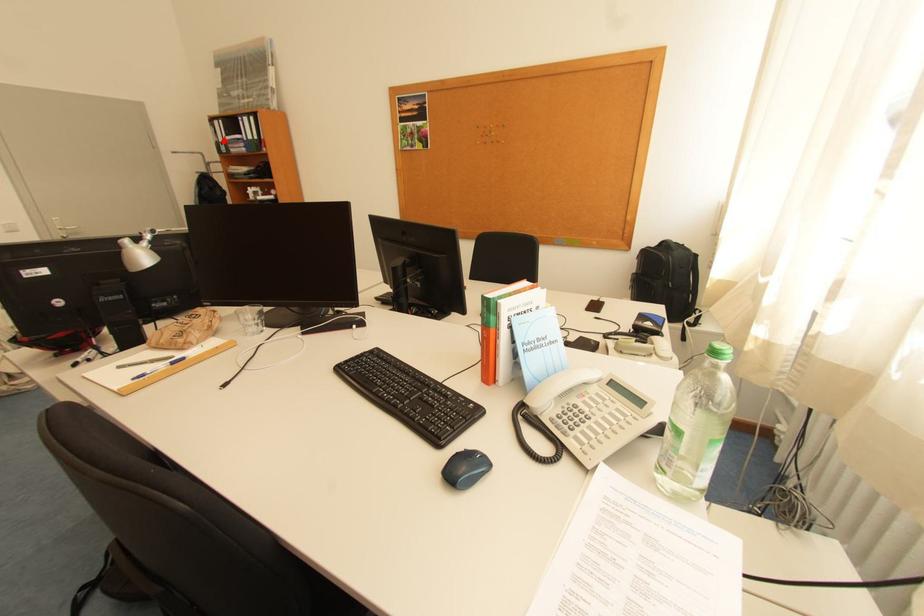
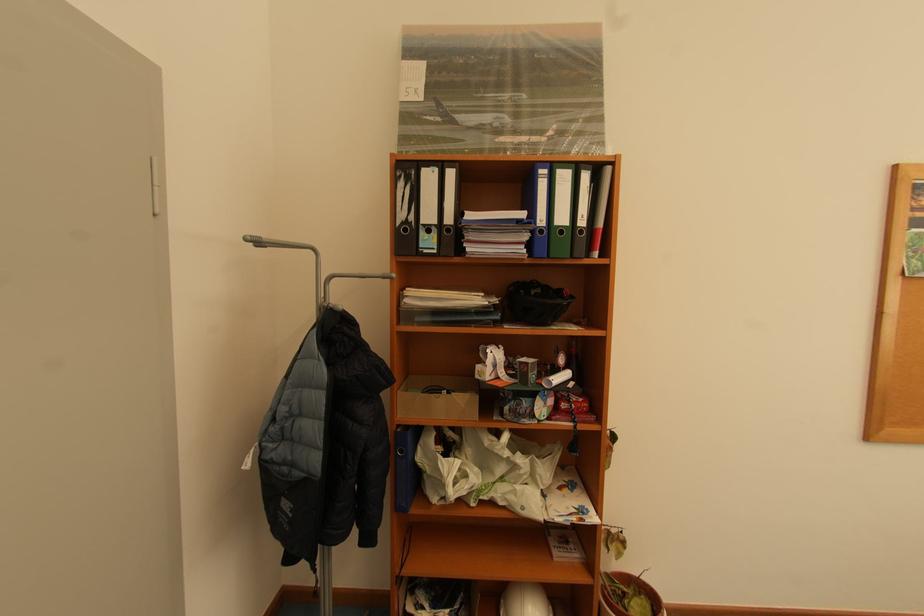
Locate, in the second image, the point that corresponds to the highlighted location in the first image.

(409, 217)